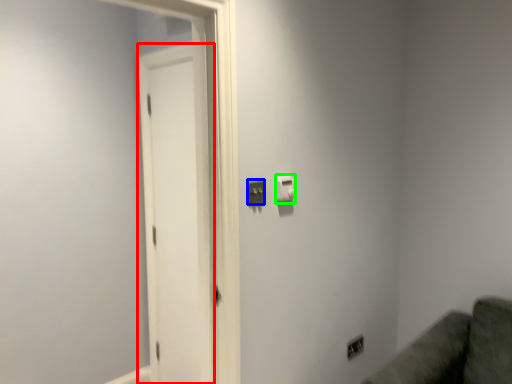
Question: Which object is positioned closest to screen door (highlighted by a red box)? Select from light switch (highlighted by a blue box) and light switch (highlighted by a green box).

Choices:
 (A) light switch
 (B) light switch

Answer: (B)